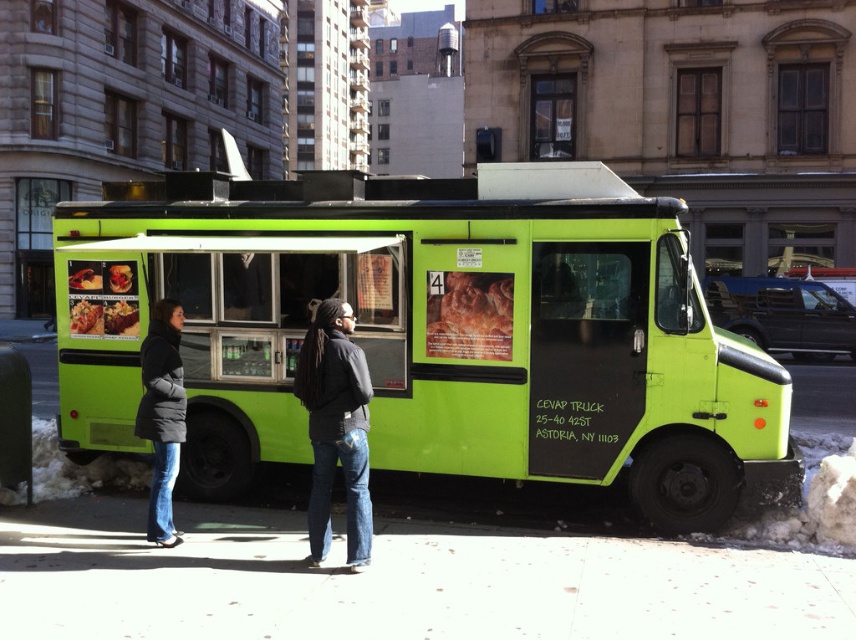
Is matte plastic plate at center taller than matte black bowl at center?

Indeed, matte plastic plate at center has a greater height compared to matte black bowl at center.

Can you confirm if matte plastic plate at center is bigger than matte black bowl at center?

Yes, matte plastic plate at center is bigger than matte black bowl at center.

Who is more distant from viewer, [72,326] or [122,268]?

Point [72,326]

Where is `matte plastic plate at center`? This screenshot has height=640, width=856. matte plastic plate at center is located at coordinates (85, 317).

Is smooth concrete sidewalk at center positioned in front of matte plastic plate at center?

Yes.

Is the position of smooth concrete sidewalk at center more distant than that of matte plastic plate at center?

That is False.

Is point (57, 561) farther from camera compared to point (96, 305)?

No, (57, 561) is closer to viewer.

Locate an element on the screen. The height and width of the screenshot is (640, 856). smooth concrete sidewalk at center is located at coordinates (397, 580).

Does smooth concrete sidewalk at center have a greater width compared to golden crispy bread at center?

Correct, the width of smooth concrete sidewalk at center exceeds that of golden crispy bread at center.

What do you see at coordinates (397, 580) in the screenshot?
I see `smooth concrete sidewalk at center` at bounding box center [397, 580].

This screenshot has height=640, width=856. What are the coordinates of `smooth concrete sidewalk at center` in the screenshot? It's located at (397, 580).